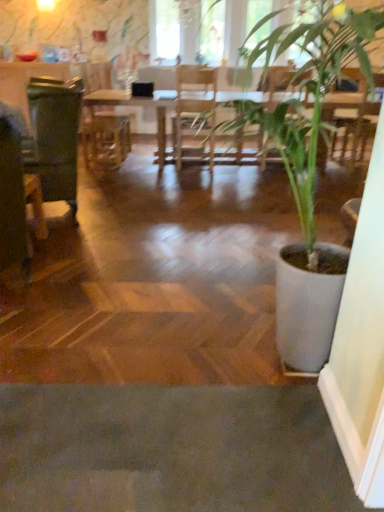
Consider the image. In order to face wooden armchair at center, should I rotate leftwards or rightwards?

To align with it, rotate left about 11.131°.

Image resolution: width=384 pixels, height=512 pixels. Describe the element at coordinates (139, 105) in the screenshot. I see `wooden table at center` at that location.

Describe the element at coordinates (211, 33) in the screenshot. I see `transparent glass window screen at upper center, the second window screen when ordered from left to right` at that location.

Find the location of a particular element. Image resolution: width=384 pixels, height=512 pixels. green leafy plant at center is located at coordinates (312, 103).

What do you see at coordinates (312, 103) in the screenshot? I see `green leafy plant at center` at bounding box center [312, 103].

Measure the distance between point (168,48) and camera.

A distance of 5.68 meters exists between point (168,48) and camera.

Where is `green matte swivel chair at left`? This screenshot has height=512, width=384. green matte swivel chair at left is located at coordinates (54, 138).

Considering the sizes of objects transparent glass window screen at upper center, the 1th window screen positioned from the left, and wooden table at center in the image provided, who is bigger, transparent glass window screen at upper center, the 1th window screen positioned from the left, or wooden table at center?

With larger size is wooden table at center.

In terms of height, does transparent glass window screen at upper center, the 1th window screen positioned from the left, look taller or shorter compared to wooden table at center?

transparent glass window screen at upper center, the 1th window screen positioned from the left, is taller than wooden table at center.

Would you consider transparent glass window screen at upper center, marked as the 2th window screen in a right-to-left arrangement, to be distant from wooden table at center?

Yes, transparent glass window screen at upper center, marked as the 2th window screen in a right-to-left arrangement, is far from wooden table at center.

Looking at their sizes, would you say transparent glass window screen at upper center, marked as the 2th window screen in a right-to-left arrangement, is wider or thinner than wooden table at center?

Considering their sizes, transparent glass window screen at upper center, marked as the 2th window screen in a right-to-left arrangement, looks slimmer than wooden table at center.

Is green leafy plant at center oriented away from transparent glass window screen at upper center, the 1th window screen viewed from the right?

That's not correct — green leafy plant at center is not looking away from transparent glass window screen at upper center, the 1th window screen viewed from the right.

Would you consider green leafy plant at center to be distant from transparent glass window screen at upper center, the second window screen when ordered from left to right?

Yes, green leafy plant at center is far from transparent glass window screen at upper center, the second window screen when ordered from left to right.

Between green leafy plant at center and transparent glass window screen at upper center, the second window screen when ordered from left to right, which one has less height?

Standing shorter between the two is transparent glass window screen at upper center, the second window screen when ordered from left to right.

From the picture: Can you confirm if wooden table at center is taller than transparent glass window screen at upper center, the 1th window screen viewed from the right?

Incorrect, the height of wooden table at center is not larger of that of transparent glass window screen at upper center, the 1th window screen viewed from the right.

From the picture: Does wooden table at center touch transparent glass window screen at upper center, the 1th window screen viewed from the right?

No, wooden table at center is not with transparent glass window screen at upper center, the 1th window screen viewed from the right.

From a real-world perspective, is wooden table at center on transparent glass window screen at upper center, the second window screen when ordered from left to right?

No.

Who is bigger, wooden table at center or transparent glass window screen at upper center, the second window screen when ordered from left to right?

With larger size is wooden table at center.

Is green matte swivel chair at left bigger than transparent glass window screen at upper center, the second window screen when ordered from left to right?

Correct, green matte swivel chair at left is larger in size than transparent glass window screen at upper center, the second window screen when ordered from left to right.

From a real-world perspective, who is located higher, green matte swivel chair at left or transparent glass window screen at upper center, the 1th window screen viewed from the right?

transparent glass window screen at upper center, the 1th window screen viewed from the right, from a real-world perspective.

Does green matte swivel chair at left have a lesser width compared to transparent glass window screen at upper center, the 1th window screen viewed from the right?

No.

Considering the positions of points (75, 92) and (207, 3), is point (75, 92) closer to camera compared to point (207, 3)?

Yes, point (75, 92) is in front of point (207, 3).

Can you tell me how much green leafy plant at center and green matte swivel chair at left differ in facing direction?

105 degrees separate the facing orientations of green leafy plant at center and green matte swivel chair at left.

Where is `swivel chair that is above the green leafy plant at center (from the image's perspective)`? This screenshot has width=384, height=512. swivel chair that is above the green leafy plant at center (from the image's perspective) is located at coordinates (x=54, y=138).

Considering the sizes of objects green leafy plant at center and green matte swivel chair at left in the image provided, who is taller, green leafy plant at center or green matte swivel chair at left?

green leafy plant at center is taller.

Considering the positions of objects green leafy plant at center and green matte swivel chair at left in the image provided, who is behind, green leafy plant at center or green matte swivel chair at left?

green matte swivel chair at left is behind.

Is point (75, 214) more distant than point (334, 98)?

No, (75, 214) is in front of (334, 98).

From a real-world perspective, which is physically above, green matte swivel chair at left or wooden table at center?

green matte swivel chair at left, from a real-world perspective.

Is green matte swivel chair at left positioned beyond the bounds of wooden table at center?

Result: Yes, green matte swivel chair at left is located beyond the bounds of wooden table at center.

Does point (162, 113) come behind point (43, 132)?

Yes, it is behind point (43, 132).

Consider the image. Measure the distance from wooden table at center to green matte swivel chair at left.

wooden table at center is 6.39 feet away from green matte swivel chair at left.

Can you confirm if wooden table at center is bigger than green matte swivel chair at left?

Correct, wooden table at center is larger in size than green matte swivel chair at left.

In order to click on the 2nd window screen behind the wooden table at center, starting your count from the anchor in this screenshot , I will do `click(167, 30)`.

Locate an element on the screen. The height and width of the screenshot is (512, 384). houseplant on the right of transparent glass window screen at upper center, the 1th window screen viewed from the right is located at coordinates (312, 103).

When comparing their distances from green matte swivel chair at left, does transparent glass window screen at upper center, the 1th window screen viewed from the right, or wooden armchair at center seem closer?

wooden armchair at center is closer to green matte swivel chair at left.

Estimate the real-world distances between objects in this image. Which object is closer to transparent glass window screen at upper center, the 1th window screen positioned from the left, green matte swivel chair at left or wooden table at center?

wooden table at center lies closer to transparent glass window screen at upper center, the 1th window screen positioned from the left, than the other object.

Which object lies nearer to the anchor point green matte swivel chair at left, wooden table at center or transparent glass window screen at upper center, the 1th window screen viewed from the right?

wooden table at center is positioned closer to the anchor green matte swivel chair at left.

Looking at the image, which one is located further to green matte swivel chair at left, green leafy plant at center or wooden armchair at center?

Among the two, green leafy plant at center is located further to green matte swivel chair at left.

From the picture: Which object lies further to the anchor point wooden table at center, transparent glass window screen at upper center, the 1th window screen positioned from the left, or transparent glass window screen at upper center, the second window screen when ordered from left to right?

transparent glass window screen at upper center, the 1th window screen positioned from the left, lies further to wooden table at center than the other object.

Based on their spatial positions, is green matte swivel chair at left or transparent glass window screen at upper center, the 1th window screen positioned from the left, further from wooden table at center?

green matte swivel chair at left lies further to wooden table at center than the other object.

Which object lies nearer to the anchor point green leafy plant at center, wooden table at center or transparent glass window screen at upper center, the 1th window screen positioned from the left?

wooden table at center is positioned closer to the anchor green leafy plant at center.

Estimate the real-world distances between objects in this image. Which object is closer to green leafy plant at center, wooden armchair at center or transparent glass window screen at upper center, the second window screen when ordered from left to right?

wooden armchair at center is closer to green leafy plant at center.

Locate an element on the screen. table positioned between green matte swivel chair at left and wooden armchair at center from near to far is located at coordinates (139, 105).

Locate an element on the screen. The width and height of the screenshot is (384, 512). armchair between green matte swivel chair at left and transparent glass window screen at upper center, the second window screen when ordered from left to right, in the front-back direction is located at coordinates (105, 135).

Where is `window screen between green matte swivel chair at left and transparent glass window screen at upper center, marked as the 2th window screen in a right-to-left arrangement, in the front-back direction`? The height and width of the screenshot is (512, 384). window screen between green matte swivel chair at left and transparent glass window screen at upper center, marked as the 2th window screen in a right-to-left arrangement, in the front-back direction is located at coordinates [211, 33].

Identify the location of table positioned between green leafy plant at center and transparent glass window screen at upper center, the 1th window screen positioned from the left, from near to far. This screenshot has width=384, height=512. (139, 105).